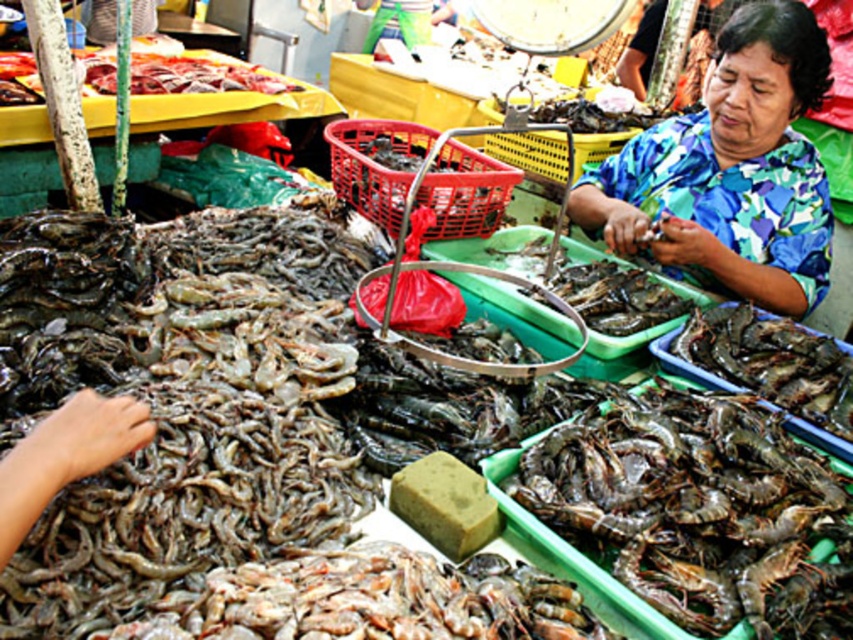
You are a delivery person who needs to pick up a package from the gray matte shrimp at lower center and deliver it to the blue floral shirt at upper right. The delivery robot you use has a maximum delivery range of 30 inches. Can the robot complete the delivery?

The gray matte shrimp at lower center is 30.63 inches away from the blue floral shirt at upper right. Since the robot has a maximum range of 30 inches, it cannot complete the delivery as the distance exceeds its limit.

You are a customer at the seafood market. You see the gray matte shrimp at lower center and the blue floral shirt at upper right. Which object is taller?

The blue floral shirt at upper right is taller than the gray matte shrimp at lower center.